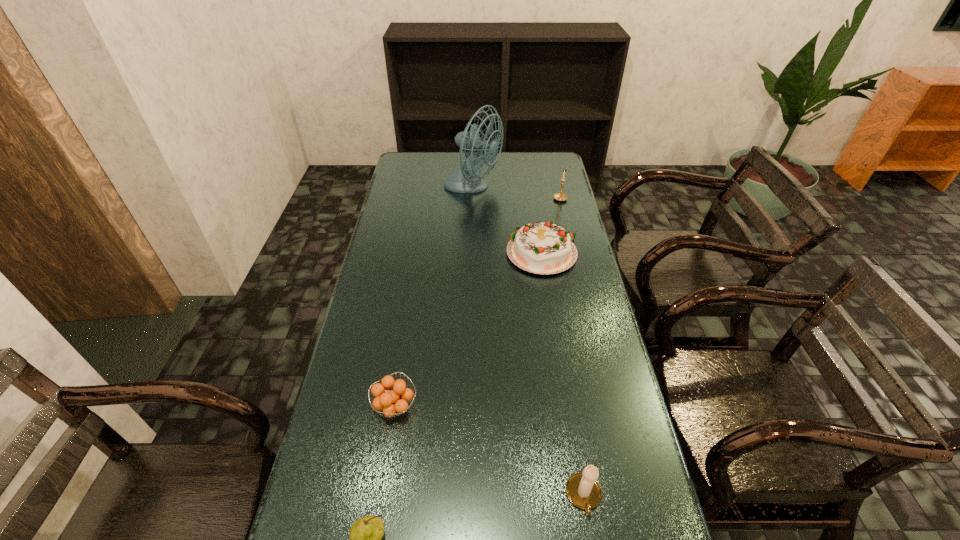
Find the location of a particular element. fan is located at coordinates (465, 179).

The height and width of the screenshot is (540, 960). In order to click on the third farthest object in this screenshot , I will do `click(542, 248)`.

You are a GUI agent. You are given a task and a screenshot of the screen. Output one action in this format:
    pyautogui.click(x=<x>, y=<y>)
    Task: Click on the right candle holder
    The width and height of the screenshot is (960, 540).
    Given the screenshot: What is the action you would take?
    pyautogui.click(x=561, y=196)

What are the coordinates of `the left candle holder` in the screenshot? It's located at [583, 490].

Locate an element on the screen. the nearer candle holder is located at coordinates (583, 490).

At what (x,y) coordinates should I click in order to perform the action: click on the shortest object. Please return your answer as a coordinate pair (x, y). The width and height of the screenshot is (960, 540). Looking at the image, I should click on (393, 402).

At what (x,y) coordinates should I click in order to perform the action: click on the third nearest object. Please return your answer as a coordinate pair (x, y). This screenshot has width=960, height=540. Looking at the image, I should click on (393, 402).

You are a GUI agent. You are given a task and a screenshot of the screen. Output one action in this format:
    pyautogui.click(x=<x>, y=<y>)
    Task: Click on the free space located in front of the tallest object to blow air
    The height and width of the screenshot is (540, 960).
    Given the screenshot: What is the action you would take?
    pyautogui.click(x=515, y=188)

This screenshot has width=960, height=540. What are the coordinates of `free spot located 0.350m on the back of the third farthest object` in the screenshot? It's located at (532, 184).

At what (x,y) coordinates should I click in order to perform the action: click on vacant region located on the handle side of the farther candle holder. Please return your answer as a coordinate pair (x, y). Looking at the image, I should click on (570, 241).